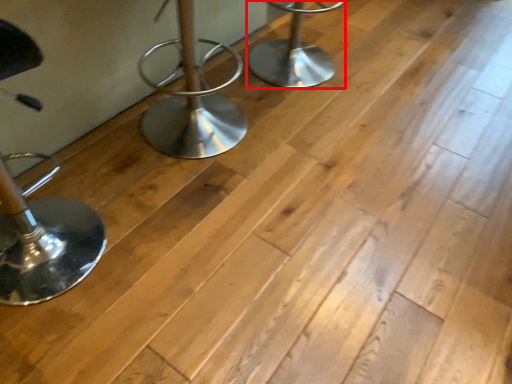
Question: From the image's perspective, what is the correct spatial positioning of furniture (annotated by the red box) in reference to furniture?

Choices:
 (A) below
 (B) above

Answer: (B)